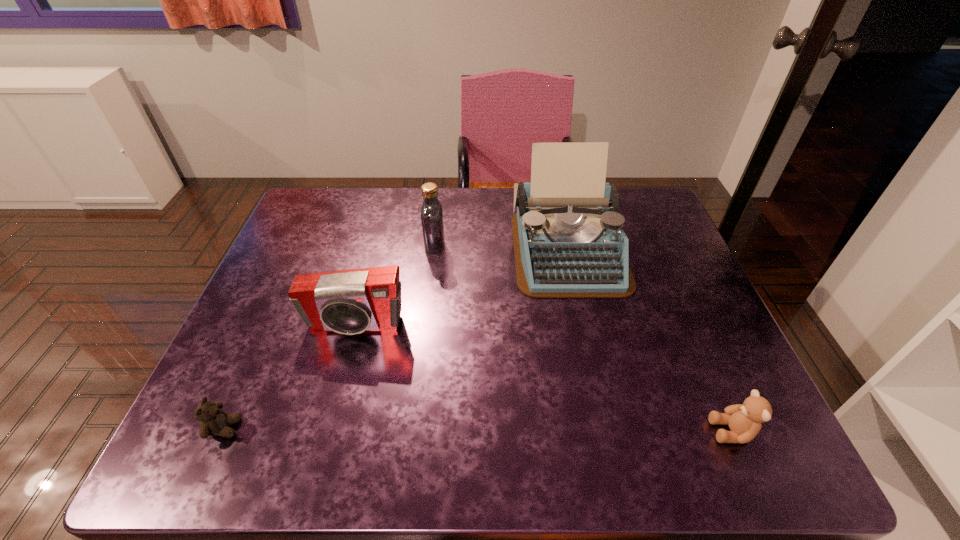
Find the location of a particular element. The width and height of the screenshot is (960, 540). free region located on the typing side of the typewriter is located at coordinates (585, 332).

In order to click on blank space located 0.080m on the front-facing side of the second tallest object in this screenshot , I will do `click(472, 246)`.

At what (x,y) coordinates should I click in order to perform the action: click on vacant space situated 0.060m on the front-facing side of the third nearest object. Please return your answer as a coordinate pair (x, y). The height and width of the screenshot is (540, 960). Looking at the image, I should click on (345, 362).

What are the coordinates of `vacant space situated 0.360m on the front-facing side of the rightmost object` in the screenshot? It's located at pyautogui.click(x=526, y=431).

Find the location of a particular element. Image resolution: width=960 pixels, height=540 pixels. vacant space located on the front-facing side of the rightmost object is located at coordinates (531, 431).

Image resolution: width=960 pixels, height=540 pixels. I want to click on vacant position located on the front-facing side of the rightmost object, so click(x=520, y=431).

Find the location of a particular element. Image resolution: width=960 pixels, height=540 pixels. vacant area located 0.140m on the face of the shortest object is located at coordinates (312, 428).

Image resolution: width=960 pixels, height=540 pixels. I want to click on object positioned at the far edge, so click(x=568, y=240).

You are a GUI agent. You are given a task and a screenshot of the screen. Output one action in this format:
    pyautogui.click(x=<x>, y=<y>)
    Task: Click on the camera situated at the left edge
    The height and width of the screenshot is (540, 960).
    Given the screenshot: What is the action you would take?
    pyautogui.click(x=349, y=302)

Where is `teddy bear at the left edge`? The width and height of the screenshot is (960, 540). teddy bear at the left edge is located at coordinates (214, 421).